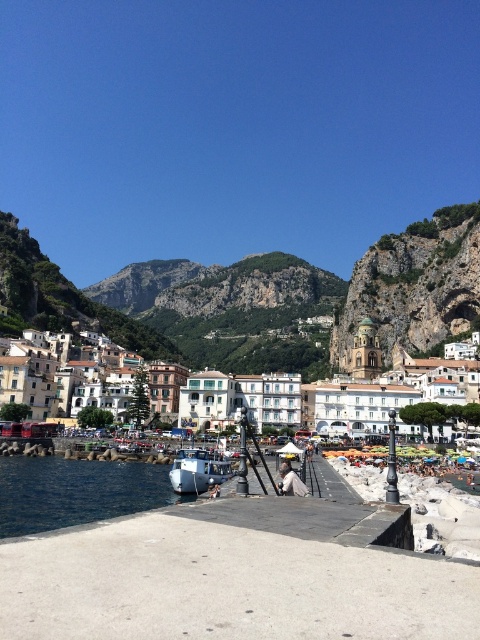
Can you confirm if white stucco buildings at center is bigger than white matte boat at center?

Yes.

Where is `white stucco buildings at center`? The width and height of the screenshot is (480, 640). white stucco buildings at center is located at coordinates (304, 403).

Is white stucco buildings at center taller than deep blue water at lower left?

Correct, white stucco buildings at center is much taller as deep blue water at lower left.

Is white stucco buildings at center to the right of deep blue water at lower left from the viewer's perspective?

Correct, you'll find white stucco buildings at center to the right of deep blue water at lower left.

Does point (405, 394) come in front of point (168, 483)?

No, (405, 394) is behind (168, 483).

What are the coordinates of `white stucco buildings at center` in the screenshot? It's located at (304, 403).

Is deep blue water at lower left below white matte boat at center?

Yes.

Can you confirm if deep blue water at lower left is positioned above white matte boat at center?

Incorrect, deep blue water at lower left is not positioned above white matte boat at center.

This screenshot has height=640, width=480. What do you see at coordinates (74, 492) in the screenshot?
I see `deep blue water at lower left` at bounding box center [74, 492].

Locate an element on the screen. deep blue water at lower left is located at coordinates (74, 492).